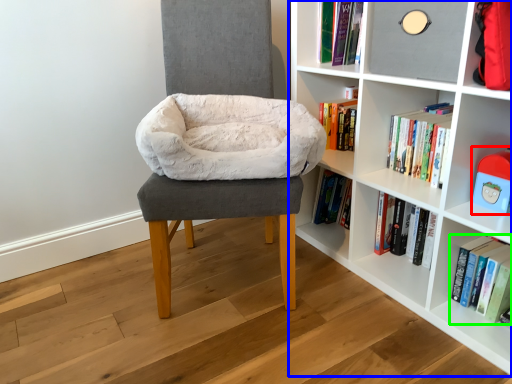
Question: Estimate the real-world distances between objects in this image. Which object is farther from toy (highlighted by a red box), shelf (highlighted by a blue box) or book (highlighted by a green box)?

Choices:
 (A) shelf
 (B) book

Answer: (A)